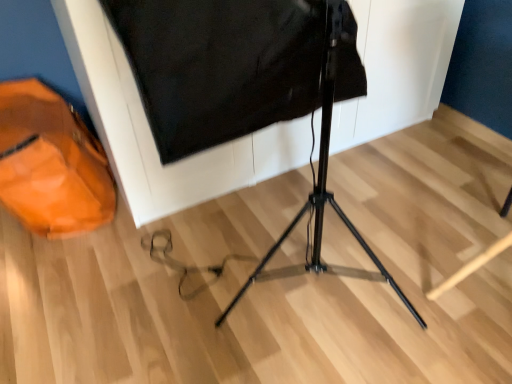
Where is `free space in front of orange leather tote at lower left`? free space in front of orange leather tote at lower left is located at coordinates (67, 286).